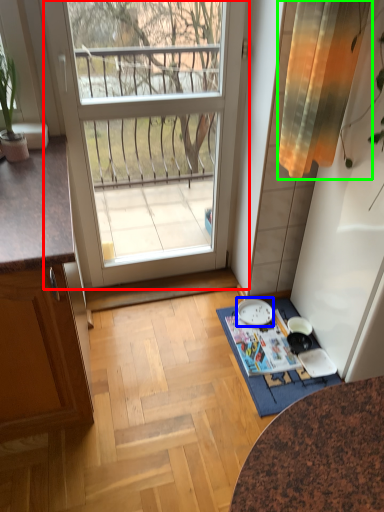
Question: Considering the real-world distances, which object is closest to door (highlighted by a red box)? plate (highlighted by a blue box) or curtain (highlighted by a green box).

Choices:
 (A) plate
 (B) curtain

Answer: (B)